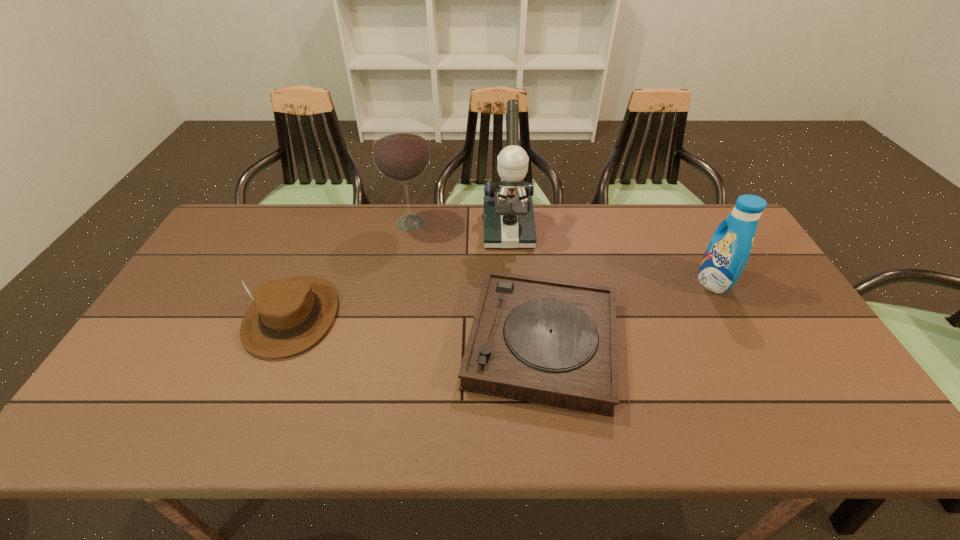
The height and width of the screenshot is (540, 960). Find the location of `blank space at the right edge of the desktop`. blank space at the right edge of the desktop is located at coordinates (769, 327).

Identify the location of free space at the near left corner of the desktop. The height and width of the screenshot is (540, 960). (94, 436).

You are a GUI agent. You are given a task and a screenshot of the screen. Output one action in this format:
    pyautogui.click(x=<x>, y=<y>)
    Task: Click on the vacant area at the far right corner of the desktop
    The image size is (960, 540).
    Given the screenshot: What is the action you would take?
    pyautogui.click(x=706, y=219)

This screenshot has height=540, width=960. Identify the location of vacant area that lies between the fedora and the alcohol. (351, 269).

Locate an element on the screen. The width and height of the screenshot is (960, 540). free spot between the shortest object and the fourth object from right to left is located at coordinates (476, 283).

At what (x,y) coordinates should I click in order to perform the action: click on free space that is in between the microscope and the detergent. Please return your answer as a coordinate pair (x, y). Looking at the image, I should click on (611, 255).

Find the location of a particular element. The image size is (960, 540). empty space between the fedora and the alcohol is located at coordinates (351, 269).

The width and height of the screenshot is (960, 540). Find the location of `vacant area that lies between the alcohol and the fedora`. vacant area that lies between the alcohol and the fedora is located at coordinates (351, 269).

At what (x,y) coordinates should I click in order to perform the action: click on vacant space that's between the microscope and the detergent. Please return your answer as a coordinate pair (x, y). The height and width of the screenshot is (540, 960). Looking at the image, I should click on pyautogui.click(x=611, y=255).

Locate which object ranks fourth in proximity to the second shortest object. Please provide its 2D coordinates. Your answer should be formatted as a tuple, i.e. [(x, y)], where the tuple contains the x and y coordinates of a point satisfying the conditions above.

[(729, 248)]